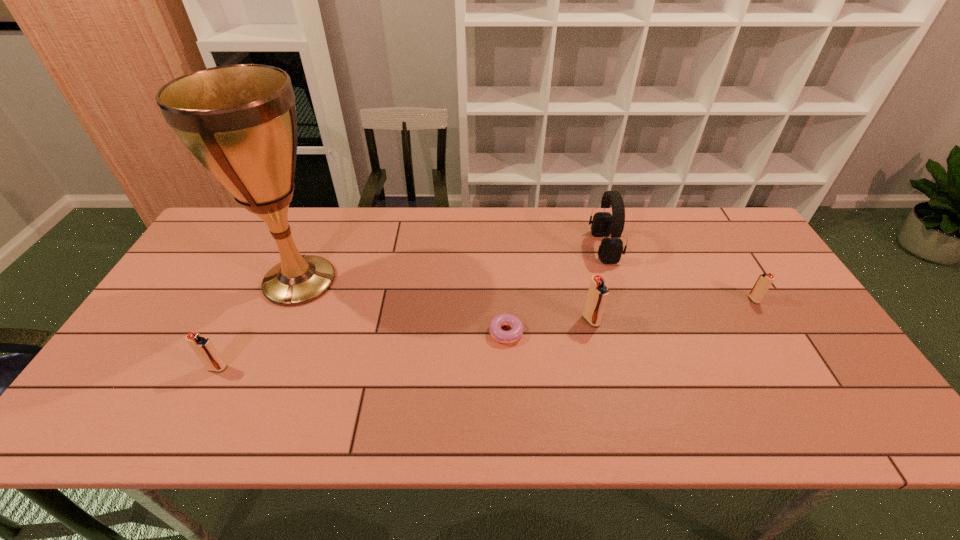
Locate an element on the screen. The width and height of the screenshot is (960, 540). the fourth tallest object is located at coordinates (202, 346).

This screenshot has width=960, height=540. What are the coordinates of `the nearest igniter` in the screenshot? It's located at (202, 346).

Image resolution: width=960 pixels, height=540 pixels. I want to click on the third object from right to left, so click(x=598, y=293).

This screenshot has width=960, height=540. Identify the location of the tallest igniter. (598, 293).

Where is `the fifth tallest object`? The image size is (960, 540). the fifth tallest object is located at coordinates (764, 281).

Image resolution: width=960 pixels, height=540 pixels. In order to click on the shortest igniter in this screenshot , I will do `click(764, 281)`.

The height and width of the screenshot is (540, 960). In order to click on the fifth object from left to right in this screenshot , I will do pos(604,224).

Where is `the fifth shortest object`? the fifth shortest object is located at coordinates (604, 224).

What are the coordinates of `doughnut` in the screenshot? It's located at (505, 319).

The height and width of the screenshot is (540, 960). I want to click on the shortest object, so click(x=505, y=319).